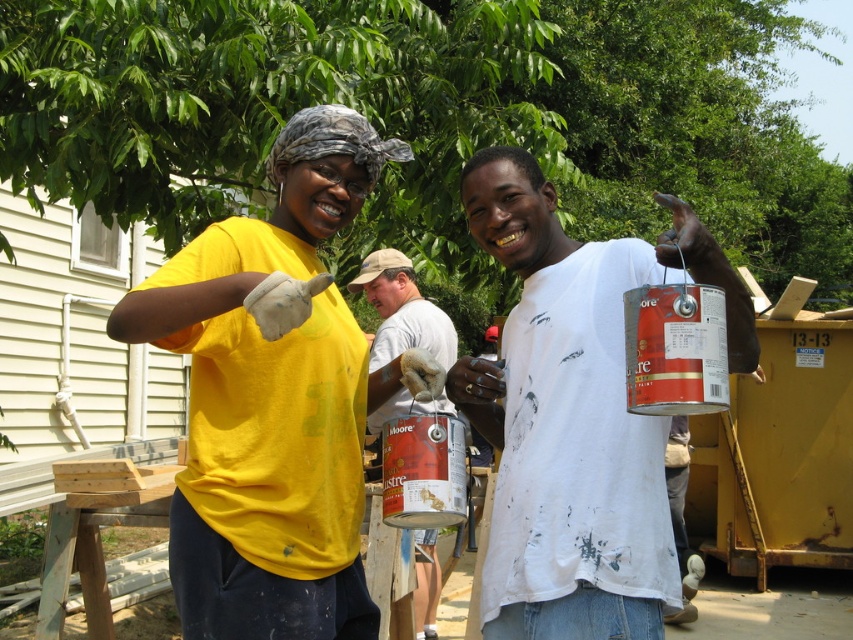
Who is more forward, [515,522] or [370,424]?

Positioned in front is point [515,522].

Between white matte paint can at center and matte gray shirt at center, which one is positioned lower?

Positioned lower is matte gray shirt at center.

Between point (492, 612) and point (401, 273), which one is positioned behind?

Positioned behind is point (401, 273).

Identify the location of white matte paint can at center. The width and height of the screenshot is (853, 640). (575, 413).

Is yellow fabric shirt at upper left bigger than matte gray shirt at center?

Actually, yellow fabric shirt at upper left might be smaller than matte gray shirt at center.

The height and width of the screenshot is (640, 853). I want to click on yellow fabric shirt at upper left, so click(276, 397).

Which is in front, point (273, 472) or point (590, 388)?

Point (273, 472) is more forward.

Who is shorter, yellow fabric shirt at upper left or white matte paint can at center?

white matte paint can at center

I want to click on yellow fabric shirt at upper left, so click(276, 397).

Where is `yellow fabric shirt at upper left`? yellow fabric shirt at upper left is located at coordinates (276, 397).